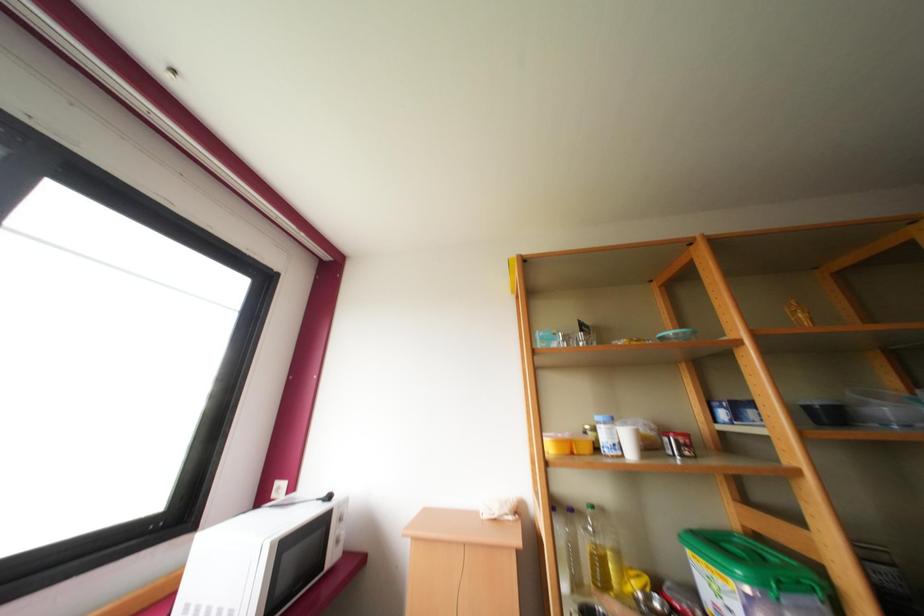
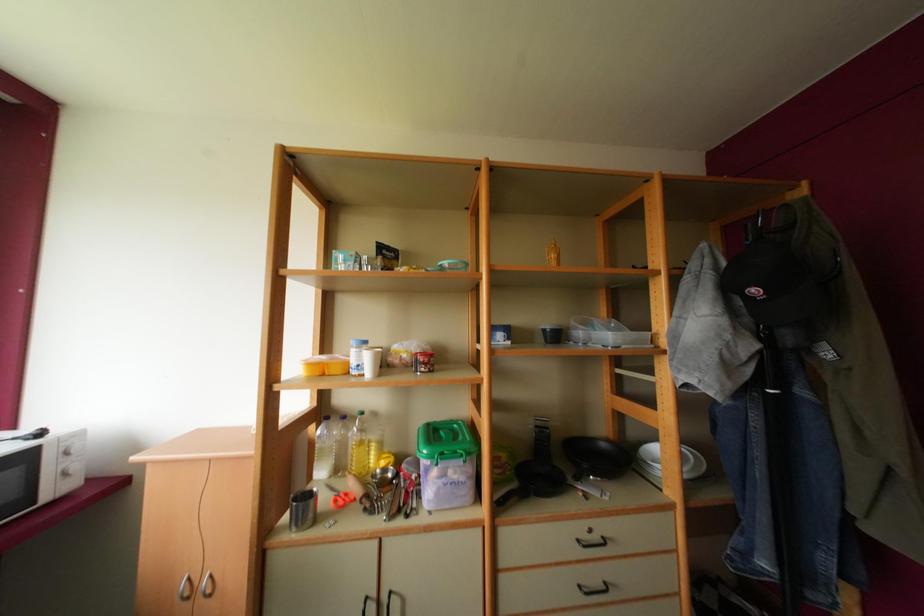
How did the camera likely rotate?

The camera rotated toward right-down.